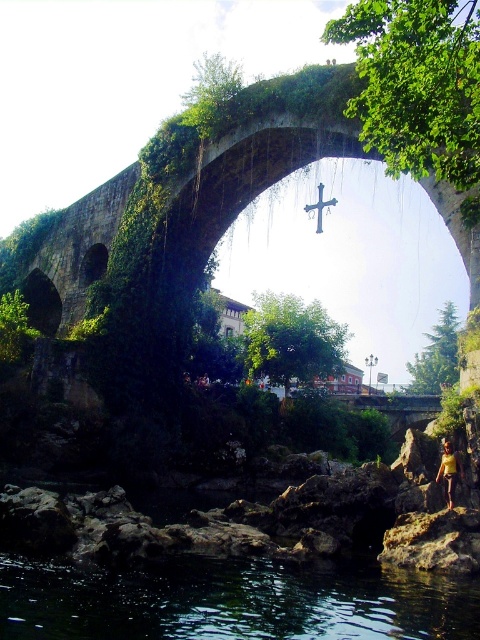
Which of these two, transparent dark water at lower center or yellow fabric person at lower right, stands taller?

Standing taller between the two is transparent dark water at lower center.

Which is behind, point (55, 598) or point (451, 444)?

The point (451, 444) is behind.

Between point (180, 582) and point (455, 456), which one is positioned in front?

Point (180, 582) is in front.

This screenshot has height=640, width=480. Find the location of `transparent dark water at lower center`. transparent dark water at lower center is located at coordinates (231, 604).